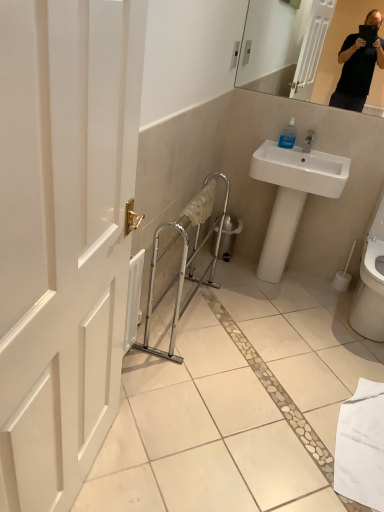
Question: From a real-world perspective, is white glossy sink at upper right positioned above or below white glossy toilet at lower right?

Choices:
 (A) above
 (B) below

Answer: (A)

Question: Looking at the image, does white glossy sink at upper right seem bigger or smaller compared to white glossy toilet at lower right?

Choices:
 (A) small
 (B) big

Answer: (B)

Question: Based on their relative distances, which object is nearer to the white glossy toilet at lower right?

Choices:
 (A) silver metallic balustrade at center
 (B) white matte toilet paper at lower right
 (C) transparent plastic soap dispenser at upper right
 (D) white glossy sink at upper right

Answer: (B)

Question: Estimate the real-world distances between objects in this image. Which object is closer to the white glossy toilet at lower right?

Choices:
 (A) white matte toilet paper at lower right
 (B) silver metallic balustrade at center
 (C) white glossy sink at upper right
 (D) transparent plastic soap dispenser at upper right

Answer: (A)